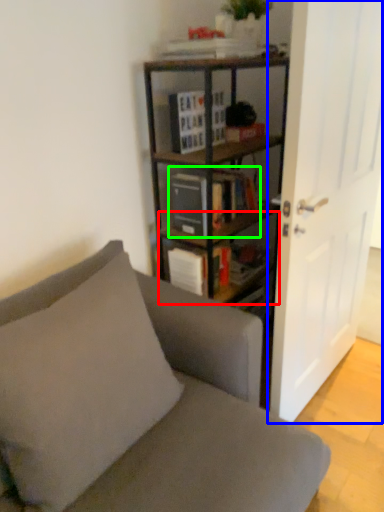
Question: Which object is positioned closest to shelf (highlighted by a red box)? Select from door (highlighted by a blue box) and book (highlighted by a green box).

Choices:
 (A) door
 (B) book

Answer: (B)